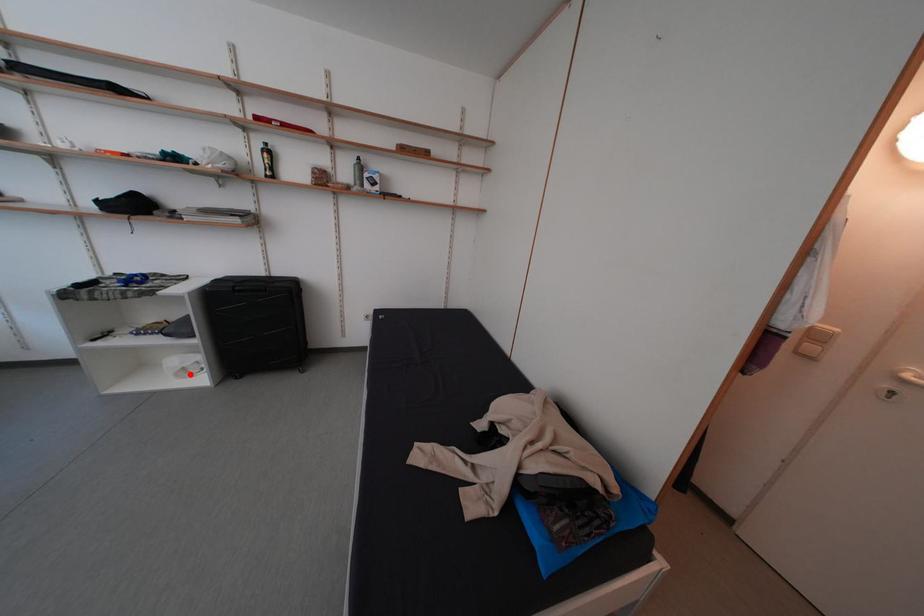
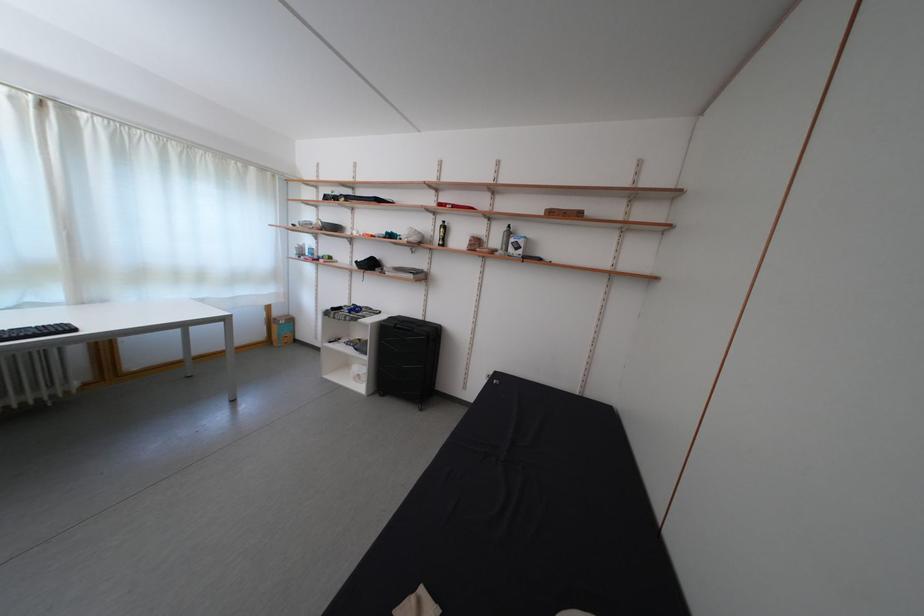
Where in the second image is the point corresponding to the highlighted location from the first image?

(365, 381)